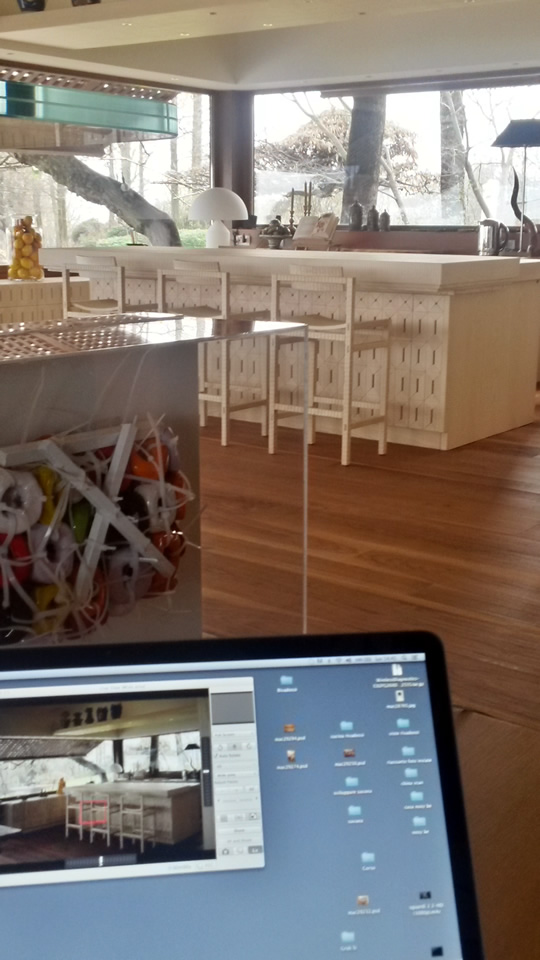
The height and width of the screenshot is (960, 540). In order to click on laptop screen in this screenshot , I will do click(x=324, y=848).